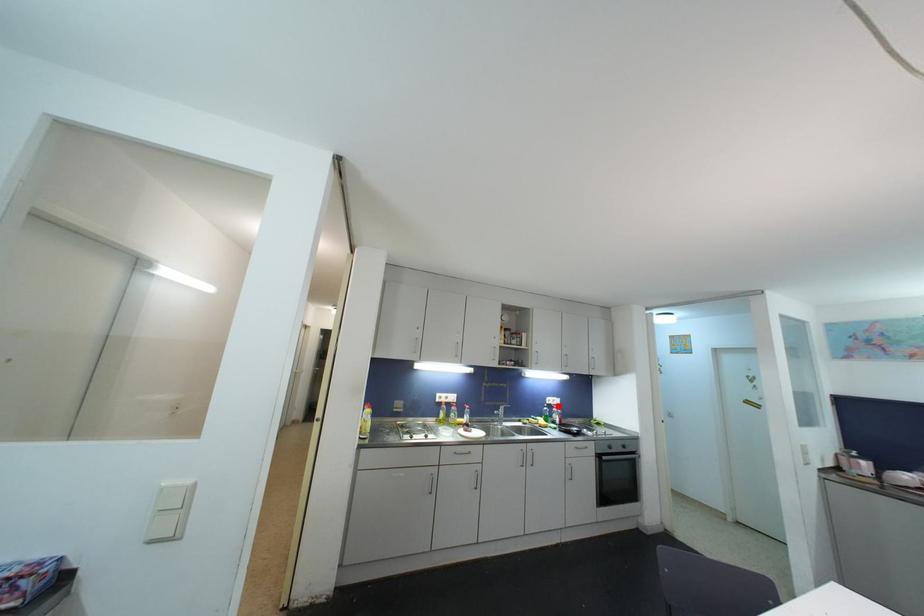
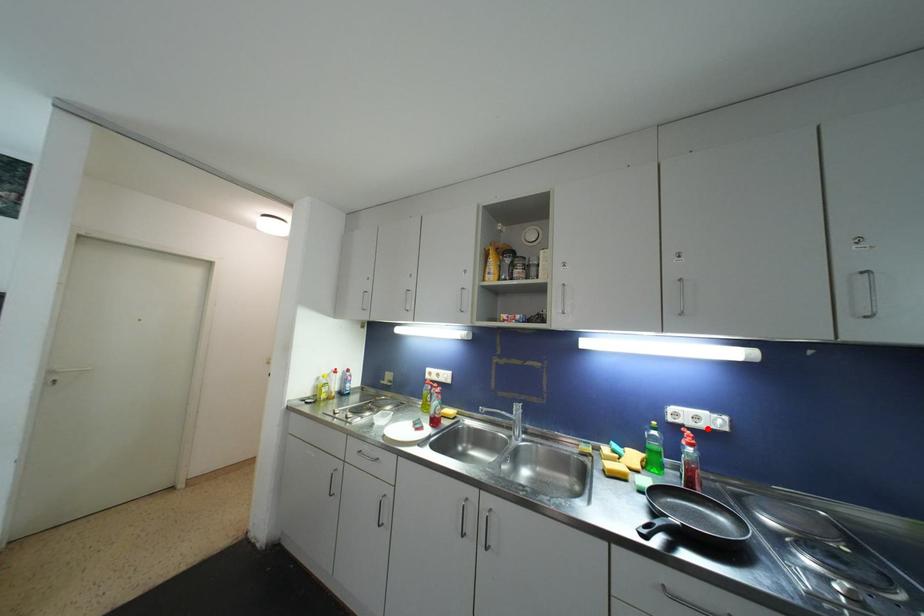
I am providing you with two images of the same scene from different viewpoints. A red point is marked on the first image and another point is marked on the second image. Are the points marked in image1 and image2 representing the same 3D position?

Yes